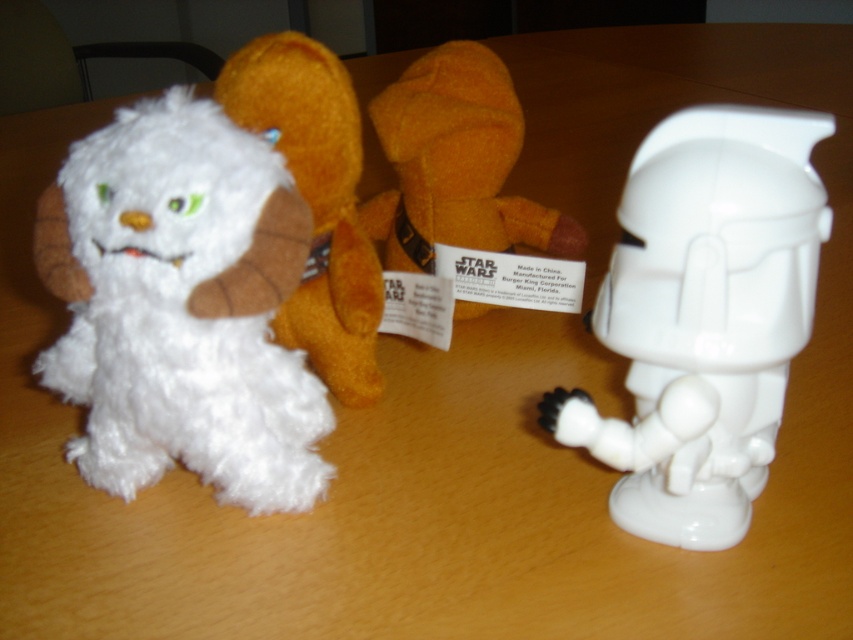
Question: Observing the image, what is the correct spatial positioning of white matte plastic stormtrooper at right in reference to white plush toy at upper left?

Choices:
 (A) above
 (B) below

Answer: (B)

Question: Can you confirm if white matte plastic stormtrooper at right is smaller than white plush toy at upper left?

Choices:
 (A) no
 (B) yes

Answer: (A)

Question: Is white fluffy stuffed animal at left below white plush toy at upper left?

Choices:
 (A) no
 (B) yes

Answer: (B)

Question: Estimate the real-world distances between objects in this image. Which object is closer to the white matte plastic stormtrooper at right?

Choices:
 (A) orange plush toy at center
 (B) white fluffy stuffed animal at left
 (C) white plush toy at upper left

Answer: (B)

Question: Which object is positioned closest to the orange plush toy at center?

Choices:
 (A) white matte plastic stormtrooper at right
 (B) white fluffy stuffed animal at left
 (C) white plush toy at upper left

Answer: (C)

Question: Which object appears closest to the camera in this image?

Choices:
 (A) white matte plastic stormtrooper at right
 (B) white plush toy at upper left
 (C) orange plush toy at center
 (D) white fluffy stuffed animal at left

Answer: (A)